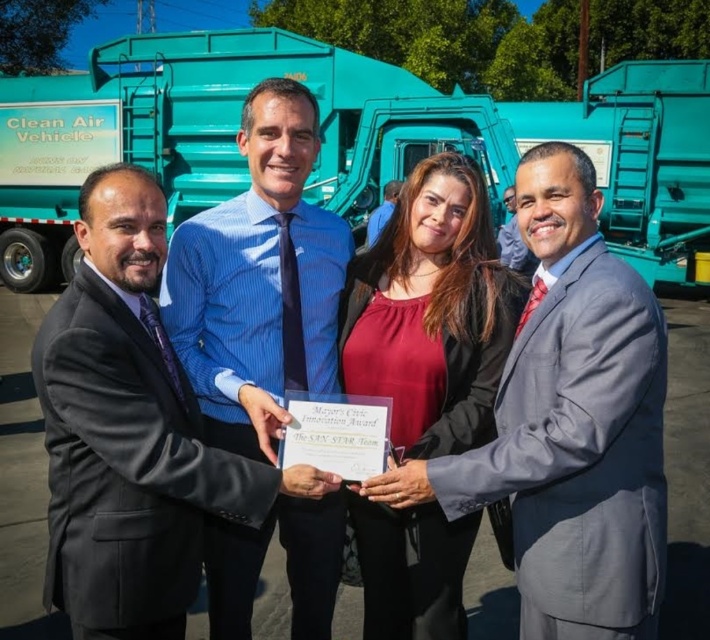
You are a photographer at the event and want to capture a photo of the matte red blouse at center and the matte blue shirt at center. Which one is closer to the camera?

The matte red blouse at center is closer to the camera since it is in front of the matte blue shirt at center.

You are a photographer at the event and want to capture a photo where both the blue striped shirt at center and the matte red blouse at center are visible. Based on their positions, which one should you focus on to ensure both are in the frame?

Since the blue striped shirt at center is positioned under the matte red blouse at center, you should focus on the matte red blouse at center to ensure both are visible in the frame.